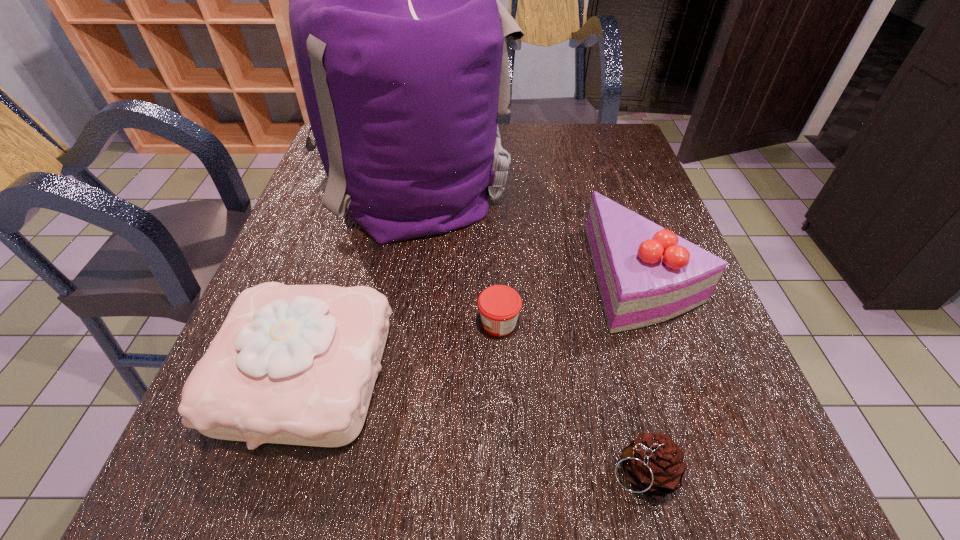
This screenshot has height=540, width=960. Identify the location of backpack. (401, 43).

Identify the location of the right cake. This screenshot has height=540, width=960. (646, 274).

Locate an element on the screen. the taller cake is located at coordinates (646, 274).

In order to click on the left cake in this screenshot , I will do `click(292, 364)`.

I want to click on the shorter cake, so click(292, 364).

Find the location of a particular element. the second shortest object is located at coordinates (654, 464).

This screenshot has height=540, width=960. I want to click on jam, so click(499, 305).

The height and width of the screenshot is (540, 960). In order to click on free space located 0.290m on the front pocket of the backpack in this screenshot , I will do `click(621, 180)`.

This screenshot has height=540, width=960. What are the coordinates of `free spot located on the back of the right cake` in the screenshot? It's located at (615, 197).

Image resolution: width=960 pixels, height=540 pixels. I want to click on vacant space located 0.400m on the right of the shorter cake, so click(618, 373).